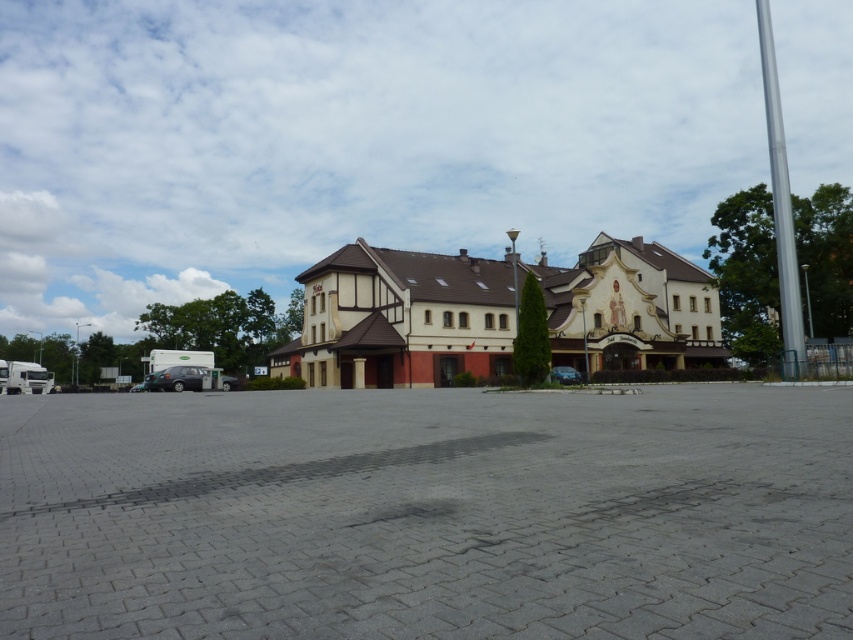
In the scene shown: Does beige brick building at center have a larger size compared to matte black car at lower left?

Correct, beige brick building at center is larger in size than matte black car at lower left.

Who is more distant from viewer, (x=375, y=332) or (x=187, y=371)?

The point (x=375, y=332) is more distant.

Locate an element on the screen. This screenshot has width=853, height=640. beige brick building at center is located at coordinates (500, 314).

Is point (54, 484) closer to viewer compared to point (688, 260)?

Yes, point (54, 484) is in front of point (688, 260).

Can you confirm if gray concrete parking lot at center is bigger than beige brick building at center?

Incorrect, gray concrete parking lot at center is not larger than beige brick building at center.

You are a GUI agent. You are given a task and a screenshot of the screen. Output one action in this format:
    pyautogui.click(x=<x>, y=<y>)
    Task: Click on the gray concrete parking lot at center
    The height and width of the screenshot is (640, 853).
    Given the screenshot: What is the action you would take?
    pyautogui.click(x=428, y=515)

Between white metallic truck at lower left and shiny black sedan at center, which one appears on the left side from the viewer's perspective?

Positioned to the left is white metallic truck at lower left.

Consider the image. Can you confirm if white metallic truck at lower left is thinner than shiny black sedan at center?

Yes.

Does point (10, 369) come behind point (573, 371)?

Yes, it is.

Where is `white metallic truck at lower left`? Image resolution: width=853 pixels, height=640 pixels. white metallic truck at lower left is located at coordinates (27, 378).